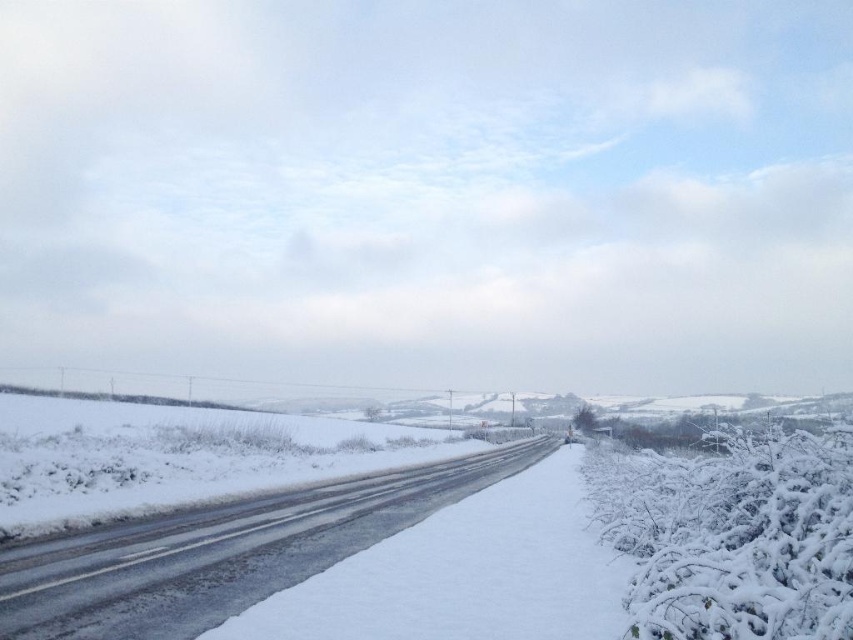
Question: Which object is closer to the camera taking this photo?

Choices:
 (A) white frosty bush at right
 (B) white frosty shrub at right
 (C) glossy asphalt highway at center

Answer: (B)

Question: In this image, where is glossy asphalt highway at center located relative to white frosty bush at right?

Choices:
 (A) left
 (B) right

Answer: (A)

Question: Does white frosty shrub at right appear on the right side of white frosty bush at right?

Choices:
 (A) no
 (B) yes

Answer: (A)

Question: Which point appears closest to the camera in this image?

Choices:
 (A) (589, 420)
 (B) (157, 557)

Answer: (B)

Question: Which object is closer to the camera taking this photo?

Choices:
 (A) glossy asphalt highway at center
 (B) white frosty shrub at right

Answer: (B)

Question: From the image, what is the correct spatial relationship of glossy asphalt highway at center in relation to white frosty bush at right?

Choices:
 (A) right
 (B) left

Answer: (B)